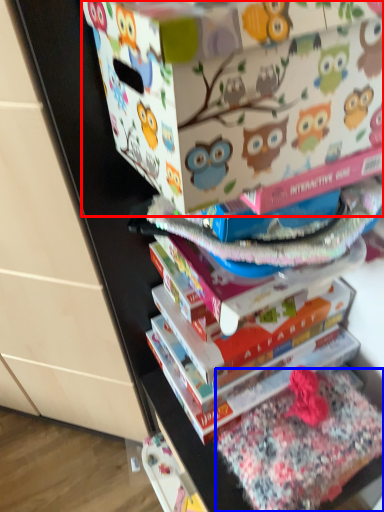
Question: Which object is further to the camera taking this photo, cardboard box (highlighted by a red box) or fabric (highlighted by a blue box)?

Choices:
 (A) cardboard box
 (B) fabric

Answer: (B)